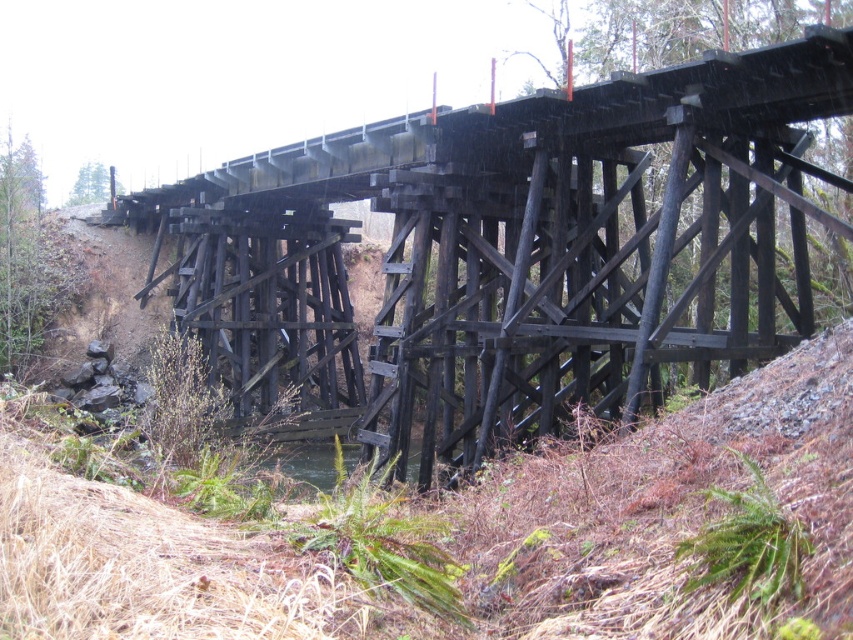
You are a hiker carrying a heavy backpack and need to cross the black wood bridge at center. Considering the size difference between the bridge and the green leafy tree at upper left, which one would be more stable for crossing?

A: The black wood bridge at center is larger in size compared to the green leafy tree at upper left, so it would be more stable for crossing.

You are a hiker carrying a 1.5 meter long backpack. You need to cross the black wood bridge at center to reach the green leafy tree at upper left. Is the bridge long enough for your backpack to pass through?

The distance between the black wood bridge at center and the green leafy tree at upper left is 17.19 meters. Since the backpack is only 1.5 meters long, the bridge is more than sufficient in length for the backpack to pass through safely.

You are standing on the wooden trestle bridge and want to place a small potted plant exactly at point (383, 545). However, you notice something there. What is already occupying that spot?

The green leafy plant at lower center is already occupying the point (383, 545).